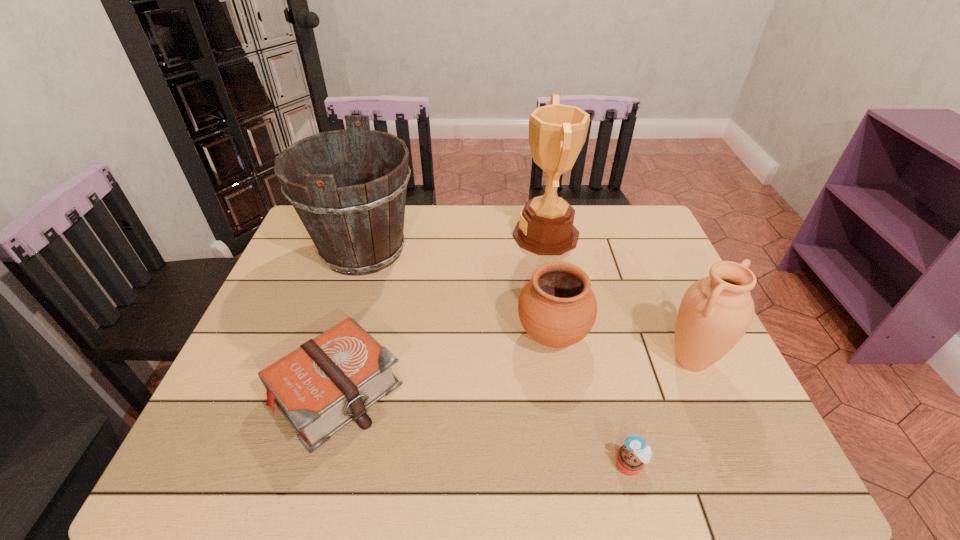
You are a GUI agent. You are given a task and a screenshot of the screen. Output one action in this format:
    pyautogui.click(x=<x>, y=<y>)
    Task: Click on the vacant space located on the front of the fifth shortest object
    The width and height of the screenshot is (960, 540).
    Given the screenshot: What is the action you would take?
    pyautogui.click(x=321, y=387)

Image resolution: width=960 pixels, height=540 pixels. I want to click on free point located on the left of the fourth shortest object, so click(632, 361).

Find the location of `vacant region located 0.170m on the front of the pottery`. vacant region located 0.170m on the front of the pottery is located at coordinates (568, 434).

Locate an element on the screen. The image size is (960, 540). vacant space situated on the left of the Bible is located at coordinates pos(220,391).

The width and height of the screenshot is (960, 540). Identify the location of award that is positioned at the far edge. (557, 133).

Where is `bucket located in the far edge section of the desktop`? Image resolution: width=960 pixels, height=540 pixels. bucket located in the far edge section of the desktop is located at coordinates (357, 224).

At what (x,y) coordinates should I click in order to perform the action: click on Bible situated at the near edge. Please return your answer as a coordinate pair (x, y). Looking at the image, I should click on (327, 382).

You are a GUI agent. You are given a task and a screenshot of the screen. Output one action in this format:
    pyautogui.click(x=<x>, y=<y>)
    Task: Click on the muffin that is at the near edge
    The image size is (960, 540).
    Given the screenshot: What is the action you would take?
    pyautogui.click(x=631, y=457)

The image size is (960, 540). Find the location of `bucket that is at the left edge`. bucket that is at the left edge is located at coordinates (357, 224).

Locate an element on the screen. Bible present at the left edge is located at coordinates (327, 382).